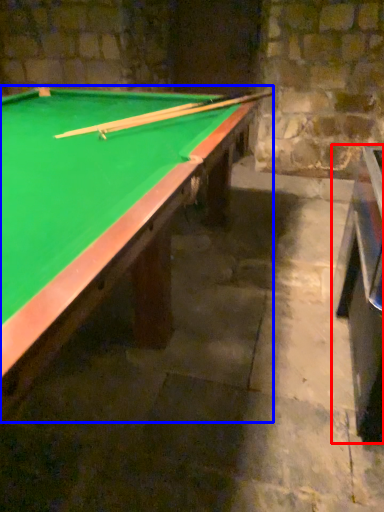
Question: Which of the following is the farthest to the observer, table (highlighted by a red box) or billiard table (highlighted by a blue box)?

Choices:
 (A) table
 (B) billiard table

Answer: (A)